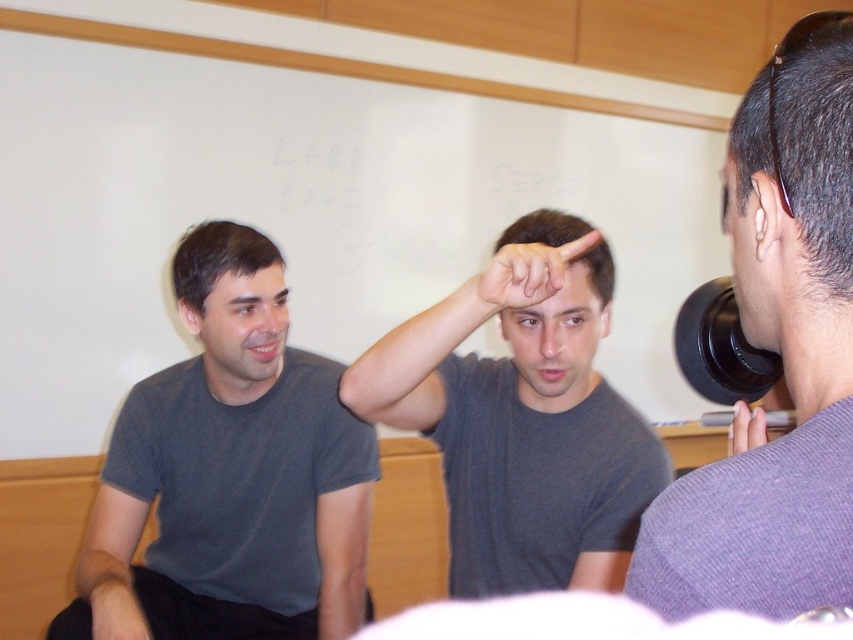
Is point (271, 268) more distant than point (199, 312)?

Yes, point (271, 268) is behind point (199, 312).

Is matte gray forehead at center behind matte gray ear at left?

No.

What do you see at coordinates (251, 280) in the screenshot? The width and height of the screenshot is (853, 640). I see `matte gray forehead at center` at bounding box center [251, 280].

Locate an element on the screen. Image resolution: width=853 pixels, height=640 pixels. matte gray forehead at center is located at coordinates (251, 280).

Which is below, purple matte shirt at right or matte black hand at upper right?

Positioned lower is matte black hand at upper right.

Does purple matte shirt at right appear on the left side of matte black hand at upper right?

Indeed, purple matte shirt at right is positioned on the left side of matte black hand at upper right.

Who is more distant from viewer, (767, 538) or (741, 413)?

The point (741, 413) is more distant.

Where is `purple matte shirt at right`? The image size is (853, 640). purple matte shirt at right is located at coordinates 782,364.

Looking at this image, who is more forward, (753, 216) or (138, 636)?

Point (753, 216) is in front.

Find the location of `light skin/soft tissue ear at upper right`. light skin/soft tissue ear at upper right is located at coordinates (764, 220).